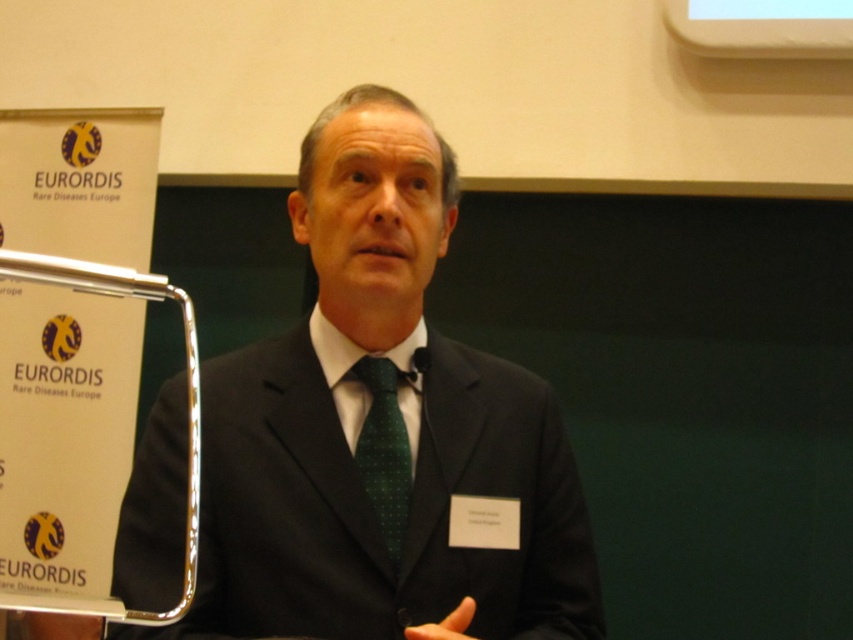
Between black matte suit at center and green dotted fabric tie at center, which one is positioned higher?

black matte suit at center is above.

Between point (167, 637) and point (372, 376), which one is positioned behind?

The point (372, 376) is more distant.

Where is `black matte suit at center`? The height and width of the screenshot is (640, 853). black matte suit at center is located at coordinates (381, 433).